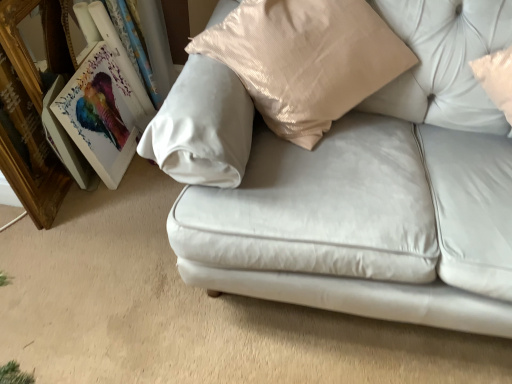
Question: Can you confirm if wooden gold picture frame at left, positioned as the 1th picture frame in left-to-right order, is thinner than satin white couch at center?

Choices:
 (A) yes
 (B) no

Answer: (A)

Question: Is wooden gold picture frame at left, the 2th picture frame when ordered from right to left, oriented away from satin white couch at center?

Choices:
 (A) no
 (B) yes

Answer: (A)

Question: Is wooden gold picture frame at left, the 2th picture frame when ordered from right to left, positioned in front of satin white couch at center?

Choices:
 (A) yes
 (B) no

Answer: (B)

Question: Is wooden gold picture frame at left, the 2th picture frame when ordered from right to left, in contact with satin white couch at center?

Choices:
 (A) yes
 (B) no

Answer: (B)

Question: From the image's perspective, is wooden gold picture frame at left, positioned as the 1th picture frame in left-to-right order, located above satin white couch at center?

Choices:
 (A) yes
 (B) no

Answer: (A)

Question: From the image's perspective, is wooden gold picture frame at left, the 2th picture frame when ordered from right to left, above or below matte wooden picture frame at left, which is the first picture frame from right to left?

Choices:
 (A) above
 (B) below

Answer: (A)

Question: In terms of size, does wooden gold picture frame at left, positioned as the 1th picture frame in left-to-right order, appear bigger or smaller than matte wooden picture frame at left, which ranks as the 2th picture frame in left-to-right order?

Choices:
 (A) small
 (B) big

Answer: (B)

Question: Which is correct: wooden gold picture frame at left, positioned as the 1th picture frame in left-to-right order, is inside matte wooden picture frame at left, which ranks as the 2th picture frame in left-to-right order, or outside of it?

Choices:
 (A) outside
 (B) inside

Answer: (A)

Question: In terms of height, does wooden gold picture frame at left, the 2th picture frame when ordered from right to left, look taller or shorter compared to matte wooden picture frame at left, which is the first picture frame from right to left?

Choices:
 (A) tall
 (B) short

Answer: (A)

Question: Is matte wooden picture frame at left, which is the first picture frame from right to left, bigger or smaller than satin white couch at center?

Choices:
 (A) small
 (B) big

Answer: (A)

Question: From the image's perspective, is matte wooden picture frame at left, which is the first picture frame from right to left, located above or below satin white couch at center?

Choices:
 (A) below
 (B) above

Answer: (A)

Question: Is matte wooden picture frame at left, which is the first picture frame from right to left, in front of or behind satin white couch at center in the image?

Choices:
 (A) front
 (B) behind

Answer: (B)

Question: In the image, is matte wooden picture frame at left, which ranks as the 2th picture frame in left-to-right order, on the left side or the right side of satin white couch at center?

Choices:
 (A) right
 (B) left

Answer: (B)

Question: From the image's perspective, is wooden gold picture frame at left, positioned as the 1th picture frame in left-to-right order, above or below satin white couch at center?

Choices:
 (A) above
 (B) below

Answer: (A)

Question: In terms of size, does wooden gold picture frame at left, positioned as the 1th picture frame in left-to-right order, appear bigger or smaller than satin white couch at center?

Choices:
 (A) small
 (B) big

Answer: (A)